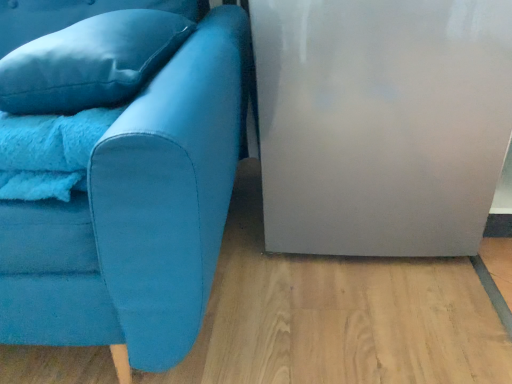
Image resolution: width=512 pixels, height=384 pixels. Find the location of `matte blue couch at left`. matte blue couch at left is located at coordinates (138, 214).

Image resolution: width=512 pixels, height=384 pixels. What do you see at coordinates (138, 214) in the screenshot? I see `matte blue couch at left` at bounding box center [138, 214].

What is the approximate height of matte blue couch at left?

It is 30.80 inches.

Find the location of a particular element. This screenshot has width=512, height=384. satin blue pillow at upper left is located at coordinates (90, 62).

What is the approximate width of satin blue pillow at upper left?

18.69 inches.

Describe the element at coordinates (90, 62) in the screenshot. I see `satin blue pillow at upper left` at that location.

Identify the location of matte blue couch at left. (138, 214).

Considering the relative positions of satin blue pillow at upper left and matte blue couch at left in the image provided, is satin blue pillow at upper left to the left of matte blue couch at left from the viewer's perspective?

Incorrect, satin blue pillow at upper left is not on the left side of matte blue couch at left.

Which object is closer to the camera taking this photo, satin blue pillow at upper left or matte blue couch at left?

matte blue couch at left is closer to the camera.

Considering the points (169, 17) and (54, 311), which point is behind, point (169, 17) or point (54, 311)?

Point (169, 17)

From the image's perspective, which is below, satin blue pillow at upper left or matte blue couch at left?

matte blue couch at left appears lower in the image.

From a real-world perspective, is satin blue pillow at upper left positioned above or below matte blue couch at left?

In terms of real-world spatial position, satin blue pillow at upper left is above matte blue couch at left.

Which of these two, satin blue pillow at upper left or matte blue couch at left, is thinner?

With smaller width is satin blue pillow at upper left.

In terms of height, does satin blue pillow at upper left look taller or shorter compared to matte blue couch at left?

satin blue pillow at upper left is shorter than matte blue couch at left.

Can you confirm if satin blue pillow at upper left is bigger than matte blue couch at left?

No, satin blue pillow at upper left is not bigger than matte blue couch at left.

Looking at this image, is matte blue couch at left completely or partially inside satin blue pillow at upper left?

No, satin blue pillow at upper left does not contain matte blue couch at left.

Is satin blue pillow at upper left not close to matte blue couch at left?

No, there isn't a large distance between satin blue pillow at upper left and matte blue couch at left.

Is matte blue couch at left at the back of satin blue pillow at upper left?

Yes, satin blue pillow at upper left is facing away from matte blue couch at left.

What's the angular difference between satin blue pillow at upper left and matte blue couch at left's facing directions?

3.41 degrees separate the facing orientations of satin blue pillow at upper left and matte blue couch at left.

Where is `pillow that is behind the matte blue couch at left`? This screenshot has width=512, height=384. pillow that is behind the matte blue couch at left is located at coordinates (90, 62).

In the image, is matte blue couch at left on the left side or the right side of satin blue pillow at upper left?

In the image, matte blue couch at left appears on the left side of satin blue pillow at upper left.

Which object is closer to the camera taking this photo, matte blue couch at left or satin blue pillow at upper left?

matte blue couch at left is more forward.

Which is in front, point (198, 198) or point (27, 53)?

The point (198, 198) is closer.

From the image's perspective, is matte blue couch at left located above or below satin blue pillow at upper left?

Based on their image positions, matte blue couch at left is located beneath satin blue pillow at upper left.

From a real-world perspective, is matte blue couch at left located beneath satin blue pillow at upper left?

Correct, in the physical world, matte blue couch at left is lower than satin blue pillow at upper left.

Does matte blue couch at left have a greater width compared to satin blue pillow at upper left?

Yes.

Which of these two, matte blue couch at left or satin blue pillow at upper left, stands shorter?

With less height is satin blue pillow at upper left.

Is matte blue couch at left smaller than satin blue pillow at upper left?

Actually, matte blue couch at left might be larger than satin blue pillow at upper left.

Do you think matte blue couch at left is within satin blue pillow at upper left, or outside of it?

matte blue couch at left is spatially situated outside satin blue pillow at upper left.

Based on the photo, is matte blue couch at left next to satin blue pillow at upper left?

No, matte blue couch at left is not touching satin blue pillow at upper left.

Is matte blue couch at left facing towards satin blue pillow at upper left?

Yes, matte blue couch at left is facing satin blue pillow at upper left.

Can you tell me how much matte blue couch at left and satin blue pillow at upper left differ in facing direction?

3.41 degrees.

Where is `studio couch that is under the satin blue pillow at upper left (from a real-world perspective)`? studio couch that is under the satin blue pillow at upper left (from a real-world perspective) is located at coordinates (138, 214).

Locate an element on the screen. pillow that is above the matte blue couch at left (from a real-world perspective) is located at coordinates (90, 62).

I want to click on pillow above the matte blue couch at left (from the image's perspective), so click(90, 62).